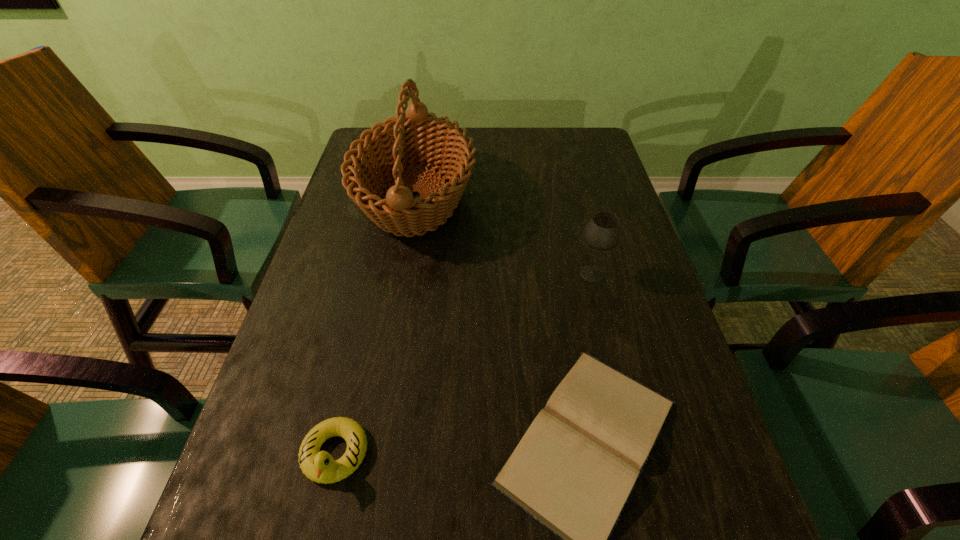
What are the coordinates of `the tallest object` in the screenshot? It's located at (398, 143).

Where is `basket`? Image resolution: width=960 pixels, height=540 pixels. basket is located at coordinates (398, 143).

Image resolution: width=960 pixels, height=540 pixels. Identify the location of the second tallest object. (603, 231).

Locate an element on the screen. the third nearest object is located at coordinates (603, 231).

This screenshot has height=540, width=960. In order to click on duckling in this screenshot , I will do `click(319, 466)`.

You are a GUI agent. You are given a task and a screenshot of the screen. Output one action in this format:
    pyautogui.click(x=<x>, y=<y>)
    Task: Click on the vacant space located on the right of the farthest object
    Image resolution: width=960 pixels, height=540 pixels.
    Given the screenshot: What is the action you would take?
    pyautogui.click(x=544, y=198)

The height and width of the screenshot is (540, 960). What are the coordinates of `free space located 0.400m on the left of the second farthest object` in the screenshot? It's located at (395, 274).

Find the location of a particular element. object positioned at the far edge is located at coordinates (398, 143).

The height and width of the screenshot is (540, 960). Identify the location of basket that is at the left edge. (398, 143).

Image resolution: width=960 pixels, height=540 pixels. Find the location of `duckling at the left edge`. duckling at the left edge is located at coordinates pos(319,466).